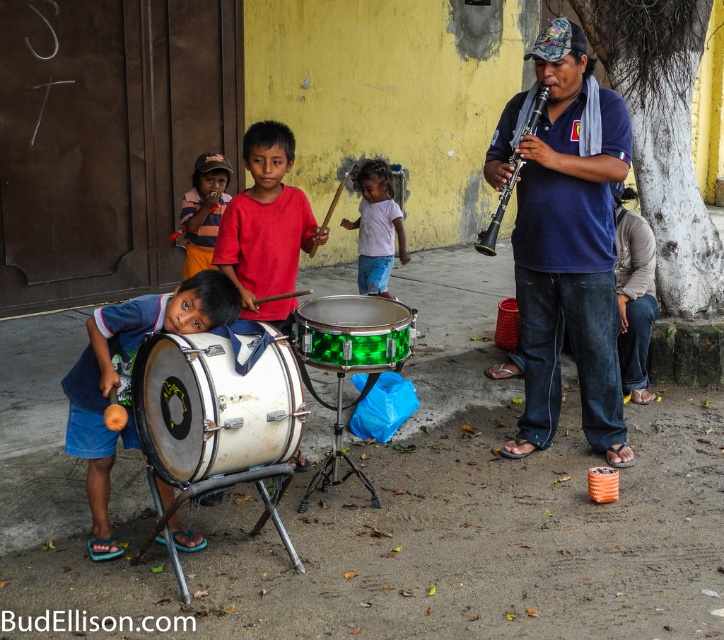
Question: Is the position of white matte drum at lower left more distant than that of black plastic clarinet at center?

Choices:
 (A) yes
 (B) no

Answer: (B)

Question: Where is blue cotton shirt at center located in relation to green glossy drum at center in the image?

Choices:
 (A) left
 (B) right

Answer: (B)

Question: Which point appears farthest from the camera in this image?

Choices:
 (A) (510, 170)
 (B) (408, 256)

Answer: (B)

Question: Which point is farther from the camera taking this photo?

Choices:
 (A) (256, 332)
 (B) (151, 321)
 (C) (536, 339)

Answer: (C)

Question: Which of the following is the closest to the observer?

Choices:
 (A) black plastic clarinet at center
 (B) white matte drum at lower left

Answer: (B)

Question: Where is green glossy drum at center located in relation to black plastic clarinet at center in the image?

Choices:
 (A) below
 (B) above

Answer: (A)